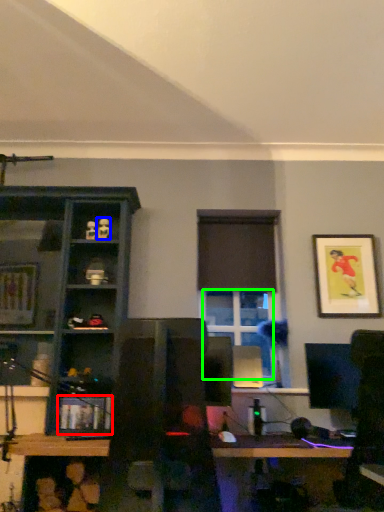
Question: Estimate the real-world distances between objects in this image. Which object is closer to shelf (highlighted by a red box), toy (highlighted by a blue box) or window (highlighted by a green box)?

Choices:
 (A) toy
 (B) window

Answer: (B)